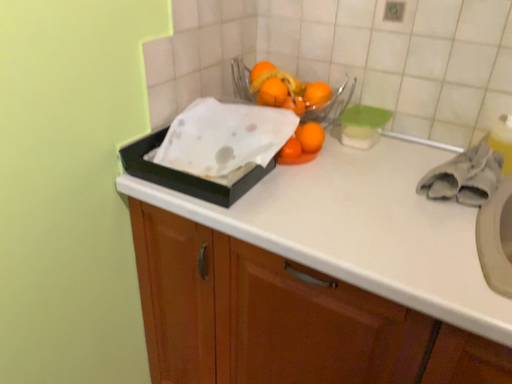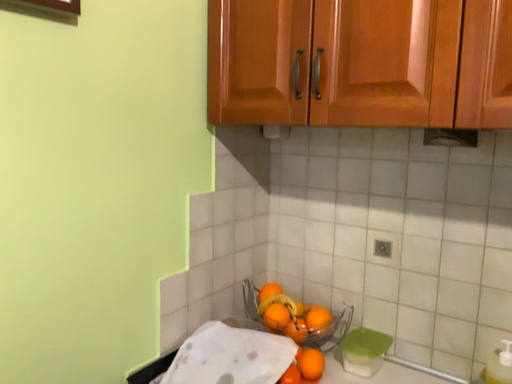
Question: Which way did the camera rotate in the video?

Choices:
 (A) rotated upward
 (B) rotated downward

Answer: (A)